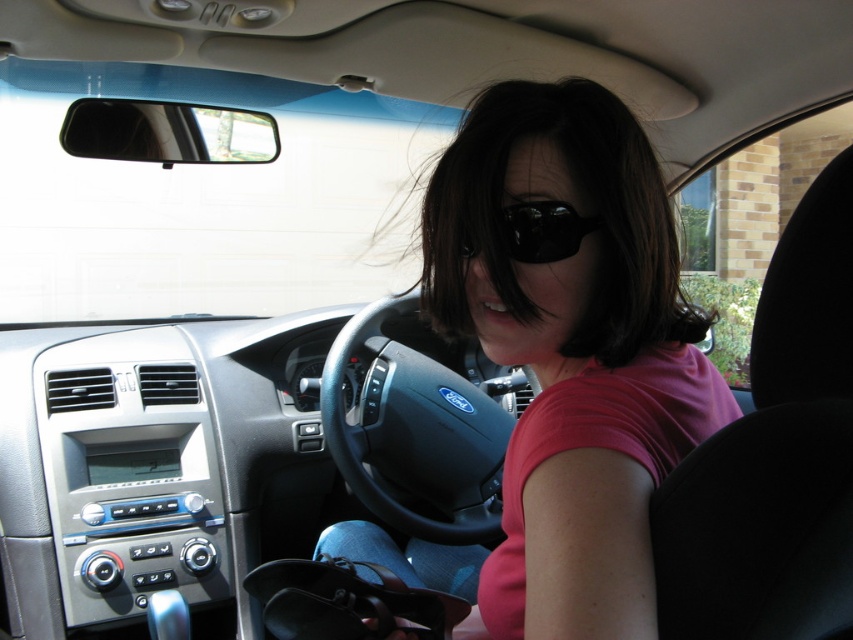
You are a fashion designer observing the driver in the car. You need to decide whether the pink matte shirt at center can be paired with the black reflective sunglasses at center based on their width. Which one is wider?

The pink matte shirt at center might be wider than black reflective sunglasses at center, so it can be paired together as the shirt is wider.

You are a passenger in the car and want to hand the driver her pink matte shirt at center. The driver is currently wearing the black reflective sunglasses at center. To reach the shirt without removing the sunglasses, should you move your hand to the left or right of the sunglasses?

The pink matte shirt at center is to the right of the black reflective sunglasses at center, so you should move your hand to the right of the sunglasses to reach it without removing them.

You are a fashion designer observing the driver in the car. You need to determine which item is bigger between the pink matte shirt at center and the black reflective sunglasses at center. Which one is larger?

The pink matte shirt at center is larger in size than the black reflective sunglasses at center.